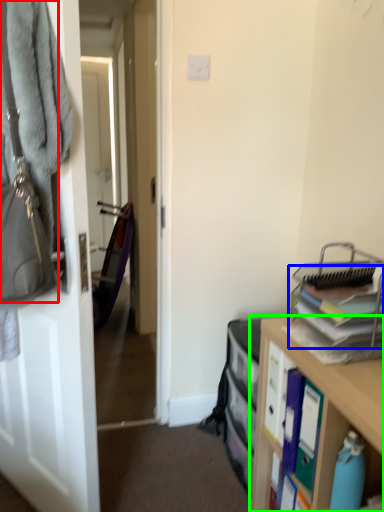
Question: Based on their relative distances, which object is nearer to handbag (highlighted by a red box)? Choose from book (highlighted by a blue box) and cabinetry (highlighted by a green box).

Choices:
 (A) book
 (B) cabinetry

Answer: (A)